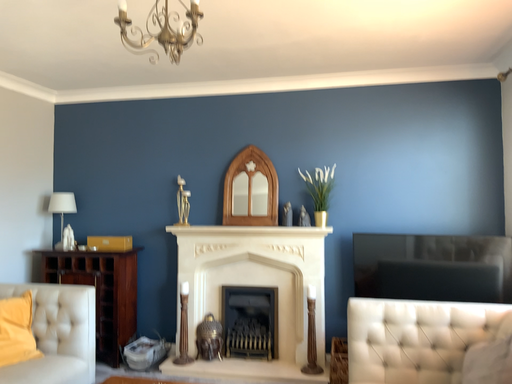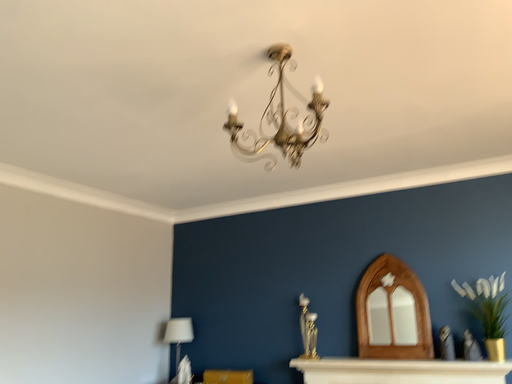
Question: Which way did the camera rotate in the video?

Choices:
 (A) rotated right
 (B) rotated left

Answer: (B)